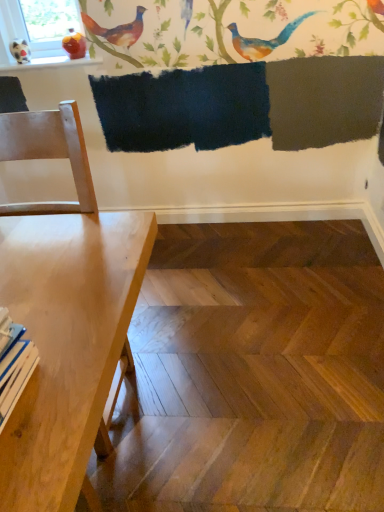
Question: Does light wood table at left appear on the right side of white glossy bird at upper left?

Choices:
 (A) yes
 (B) no

Answer: (A)

Question: Is light wood table at left closer to camera compared to white glossy bird at upper left?

Choices:
 (A) no
 (B) yes

Answer: (B)

Question: Is light wood table at left far away from white glossy bird at upper left?

Choices:
 (A) yes
 (B) no

Answer: (A)

Question: Is light wood table at left taller than white glossy bird at upper left?

Choices:
 (A) yes
 (B) no

Answer: (A)

Question: Does light wood table at left have a greater width compared to white glossy bird at upper left?

Choices:
 (A) yes
 (B) no

Answer: (A)

Question: Is light wood table at left positioned with its back to white glossy bird at upper left?

Choices:
 (A) yes
 (B) no

Answer: (B)

Question: Is white glossy bird at upper left further to camera compared to light wood table at left?

Choices:
 (A) no
 (B) yes

Answer: (B)

Question: Considering the relative sizes of white glossy bird at upper left and light wood table at left in the image provided, is white glossy bird at upper left thinner than light wood table at left?

Choices:
 (A) yes
 (B) no

Answer: (A)

Question: Is the depth of white glossy bird at upper left less than that of light wood table at left?

Choices:
 (A) yes
 (B) no

Answer: (B)

Question: Can you confirm if white glossy bird at upper left is taller than light wood table at left?

Choices:
 (A) yes
 (B) no

Answer: (B)

Question: Is white glossy bird at upper left outside of light wood table at left?

Choices:
 (A) no
 (B) yes

Answer: (B)

Question: Are white glossy bird at upper left and light wood table at left located far from each other?

Choices:
 (A) yes
 (B) no

Answer: (A)

Question: From the image's perspective, relative to white glossy bird at upper left, is light wood table at left above or below?

Choices:
 (A) below
 (B) above

Answer: (A)